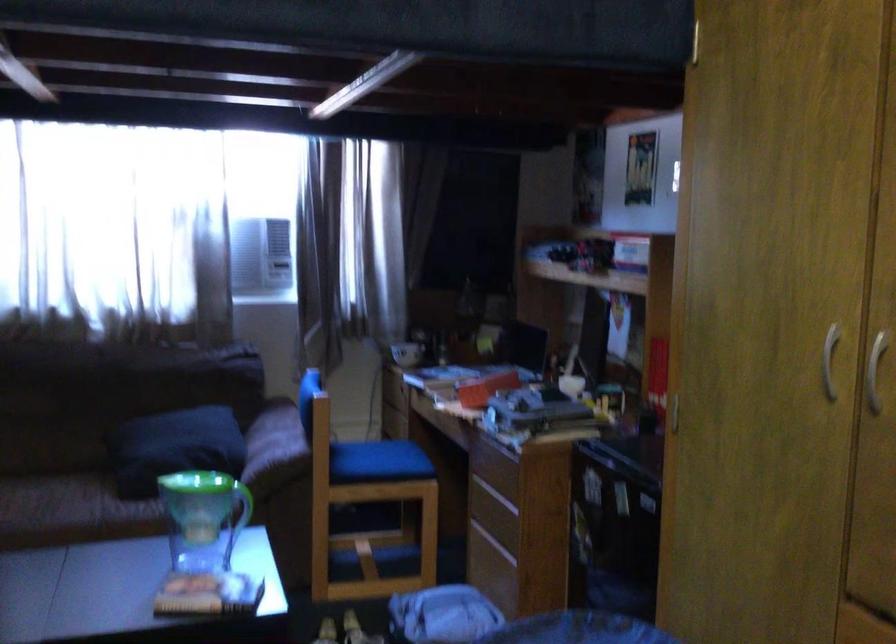
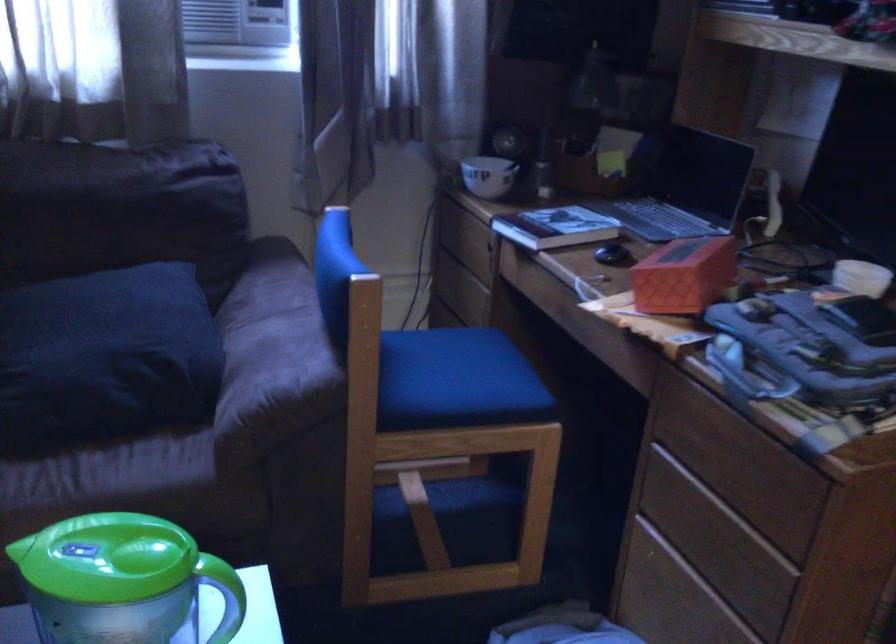
The point at (181, 448) is marked in the first image. Where is the corresponding point in the second image?

(106, 357)